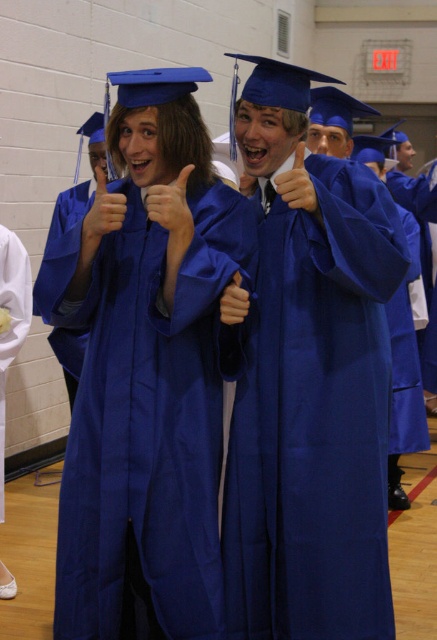
Between blue satin gown at center and matte blue thumb at upper center, which one appears on the left side from the viewer's perspective?

From the viewer's perspective, matte blue thumb at upper center appears more on the left side.

Describe the element at coordinates (146, 416) in the screenshot. The height and width of the screenshot is (640, 437). I see `blue satin gown at center` at that location.

This screenshot has width=437, height=640. I want to click on blue satin gown at center, so click(146, 416).

Between blue satin gown at center and blue satin gown at left, which one is positioned lower?

blue satin gown at center

Does blue satin gown at center have a greater height compared to blue satin gown at left?

Yes.

Between point (106, 522) and point (18, 316), which one is positioned in front?

Point (106, 522) is more forward.

Find the location of a particular element. blue satin gown at center is located at coordinates (146, 416).

Does blue satin gown at left lie in front of matte blue thumb at upper center?

No, it is behind matte blue thumb at upper center.

Which is more to the left, blue satin gown at left or matte blue thumb at upper center?

blue satin gown at left

Locate an element on the screen. This screenshot has height=640, width=437. blue satin gown at left is located at coordinates (11, 320).